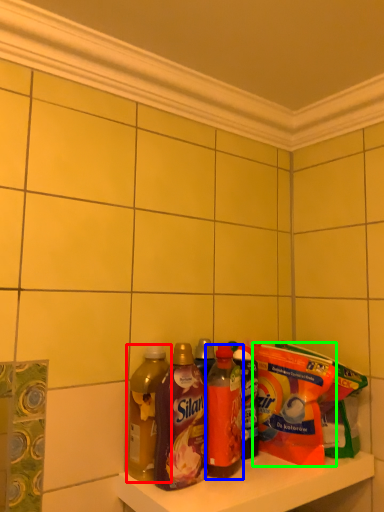
Question: Which is nearer to the bottle (highlighted by a red box)? bottle (highlighted by a blue box) or cereal (highlighted by a green box).

Choices:
 (A) bottle
 (B) cereal

Answer: (A)